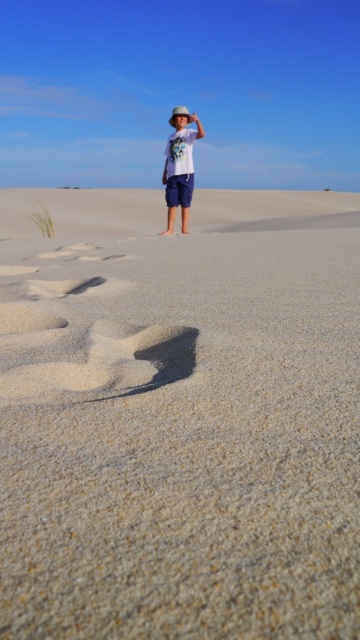
Question: Among these objects, which one is farthest from the camera?

Choices:
 (A) white cotton shirt at center
 (B) brown sandy footprint at lower left

Answer: (A)

Question: Can you confirm if fine-grained sand at center is bigger than brown sandy footprint at lower left?

Choices:
 (A) yes
 (B) no

Answer: (A)

Question: Is fine-grained sand at center further to camera compared to brown sandy footprint at lower left?

Choices:
 (A) yes
 (B) no

Answer: (B)

Question: Can you confirm if fine-grained sand at center is positioned to the left of white cotton shirt at center?

Choices:
 (A) no
 (B) yes

Answer: (B)

Question: Which point is closer to the camera?

Choices:
 (A) (192, 113)
 (B) (171, 403)

Answer: (B)

Question: Among these objects, which one is farthest from the camera?

Choices:
 (A) white cotton shirt at center
 (B) fine-grained sand at center
 (C) brown sandy footprint at lower left

Answer: (A)